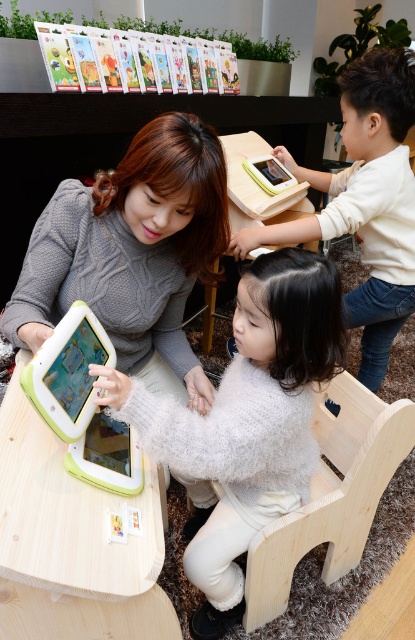
How much distance is there between natural wood table at center and matte green tablet at center?

They are 3.91 feet apart.

This screenshot has height=640, width=415. Identify the location of natural wood table at center. (258, 186).

Which is below, green matte tablet at lower center or matte green tablet at center?

matte green tablet at center is below.

Based on the photo, which is above, green matte tablet at lower center or matte green tablet at center?

green matte tablet at lower center is above.

This screenshot has height=640, width=415. Describe the element at coordinates (68, 515) in the screenshot. I see `green matte tablet at lower center` at that location.

At what (x,y) coordinates should I click in order to perform the action: click on green matte tablet at lower center. Please return your answer as a coordinate pair (x, y). This screenshot has width=415, height=640. Looking at the image, I should click on (68, 515).

Between point (326, 480) and point (246, 170), which one is positioned in front?

Point (326, 480) is more forward.

Is natural wood chair at lower center positioned in front of matte white tablet at upper center?

Yes, natural wood chair at lower center is in front of matte white tablet at upper center.

Locate an element on the screen. This screenshot has height=640, width=415. natural wood chair at lower center is located at coordinates (332, 493).